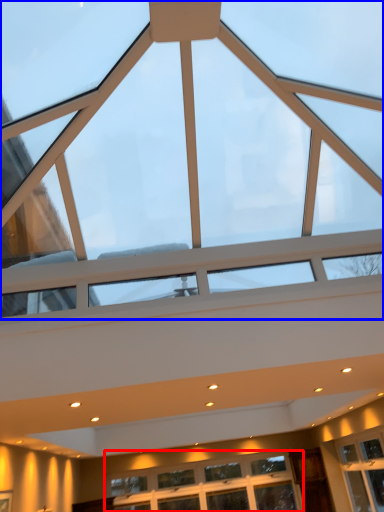
Question: Which object appears closest to the camera in this image, window (highlighted by a red box) or window (highlighted by a blue box)?

Choices:
 (A) window
 (B) window

Answer: (B)